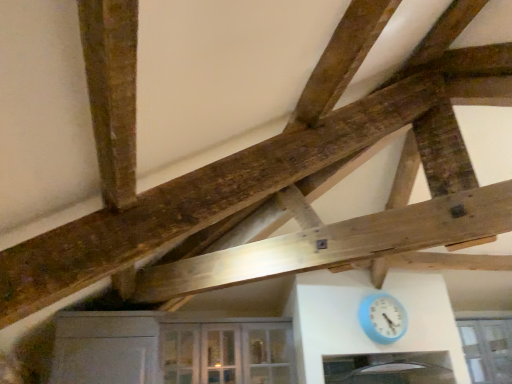
Question: Considering the positions of clear glass cabinet at lower center and clear glass window at lower right in the image, is clear glass cabinet at lower center taller or shorter than clear glass window at lower right?

Choices:
 (A) tall
 (B) short

Answer: (B)

Question: Considering the positions of clear glass cabinet at lower center and clear glass window at lower right in the image, is clear glass cabinet at lower center wider or thinner than clear glass window at lower right?

Choices:
 (A) wide
 (B) thin

Answer: (A)

Question: Estimate the real-world distances between objects in this image. Which object is closer to the clear glass window at lower right?

Choices:
 (A) clear glass cabinet at lower center
 (B) blue plastic clock at lower right

Answer: (B)

Question: Which is farther from the clear glass cabinet at lower center?

Choices:
 (A) blue plastic clock at lower right
 (B) clear glass window at lower right

Answer: (B)